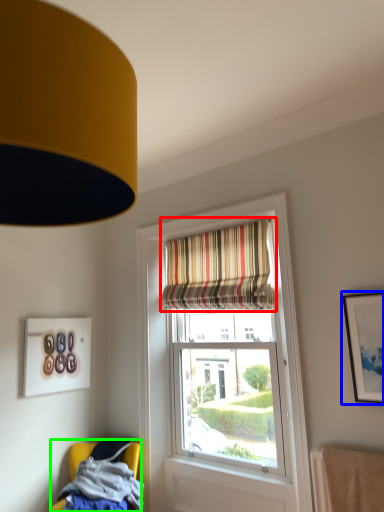
Question: Considering the real-world distances, which object is farthest from curtain (highlighted by a red box)? picture frame (highlighted by a blue box) or chair (highlighted by a green box)?

Choices:
 (A) picture frame
 (B) chair

Answer: (B)